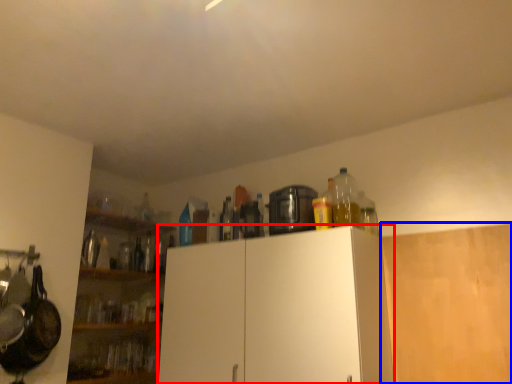
Question: Which object is closer to the camera taking this photo, cabinetry (highlighted by a red box) or cabinetry (highlighted by a blue box)?

Choices:
 (A) cabinetry
 (B) cabinetry

Answer: (A)